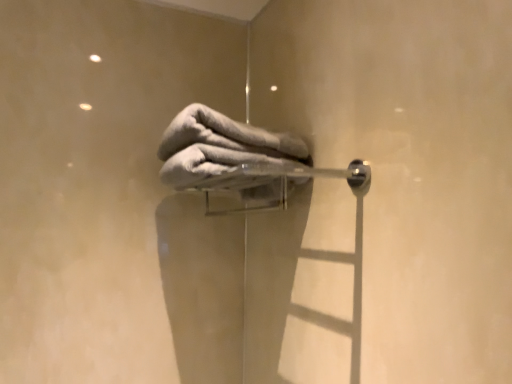
Image resolution: width=512 pixels, height=384 pixels. What do you see at coordinates (272, 184) in the screenshot?
I see `satin silver towel rack at center` at bounding box center [272, 184].

This screenshot has height=384, width=512. Find the location of `satin silver towel rack at center`. satin silver towel rack at center is located at coordinates tap(272, 184).

Describe the element at coordinates (220, 146) in the screenshot. I see `gray soft towel at center` at that location.

At what (x,y) coordinates should I click in order to perform the action: click on gray soft towel at center. Please return your answer as a coordinate pair (x, y). This screenshot has height=384, width=512. Looking at the image, I should click on (220, 146).

The height and width of the screenshot is (384, 512). Find the location of `satin silver towel rack at center`. satin silver towel rack at center is located at coordinates (272, 184).

In the scene shown: Which object is positioned more to the left, gray soft towel at center or satin silver towel rack at center?

gray soft towel at center.

Between gray soft towel at center and satin silver towel rack at center, which one is positioned in front?

satin silver towel rack at center is in front.

Which point is more forward, (207, 165) or (219, 193)?

The point (207, 165) is in front.

From the image's perspective, who appears lower, gray soft towel at center or satin silver towel rack at center?

satin silver towel rack at center appears lower in the image.

In the scene shown: From a real-world perspective, is gray soft towel at center positioned above or below satin silver towel rack at center?

gray soft towel at center is above satin silver towel rack at center.

Between gray soft towel at center and satin silver towel rack at center, which one has smaller width?

satin silver towel rack at center is thinner.

Looking at this image, which of these two, gray soft towel at center or satin silver towel rack at center, stands shorter?

Standing shorter between the two is satin silver towel rack at center.

Considering the relative sizes of gray soft towel at center and satin silver towel rack at center in the image provided, is gray soft towel at center bigger than satin silver towel rack at center?

No.

Would you say gray soft towel at center is inside or outside satin silver towel rack at center?

gray soft towel at center is not enclosed by satin silver towel rack at center.

Are gray soft towel at center and satin silver towel rack at center located far from each other?

They are positioned close to each other.

Could you tell me if gray soft towel at center is facing satin silver towel rack at center?

No, gray soft towel at center is not aimed at satin silver towel rack at center.

Can you tell me how much gray soft towel at center and satin silver towel rack at center differ in facing direction?

There is a 0.000226-degree angle between the facing directions of gray soft towel at center and satin silver towel rack at center.

This screenshot has width=512, height=384. What are the coordinates of `towel that is above the satin silver towel rack at center (from a real-world perspective)` in the screenshot? It's located at (220, 146).

Which is more to the left, satin silver towel rack at center or gray soft towel at center?

gray soft towel at center is more to the left.

In the image, is satin silver towel rack at center positioned in front of or behind gray soft towel at center?

Clearly, satin silver towel rack at center is in front of gray soft towel at center.

Does point (361, 184) appear closer or farther from the camera than point (244, 158)?

Point (361, 184).

From the image's perspective, is satin silver towel rack at center located beneath gray soft towel at center?

Yes.

From a real-world perspective, is satin silver towel rack at center positioned under gray soft towel at center based on gravity?

Yes.

Considering the relative sizes of satin silver towel rack at center and gray soft towel at center in the image provided, is satin silver towel rack at center wider than gray soft towel at center?

Incorrect, the width of satin silver towel rack at center does not surpass that of gray soft towel at center.

Between satin silver towel rack at center and gray soft towel at center, which one has more height?

gray soft towel at center.

Does satin silver towel rack at center have a larger size compared to gray soft towel at center?

Yes.

Is gray soft towel at center surrounded by satin silver towel rack at center?

No, satin silver towel rack at center does not contain gray soft towel at center.

Is satin silver towel rack at center far from gray soft towel at center?

No.

Is satin silver towel rack at center oriented towards gray soft towel at center?

No, satin silver towel rack at center is not aimed at gray soft towel at center.

Find the location of a particular element. towel behind the satin silver towel rack at center is located at coordinates (220, 146).

You are a GUI agent. You are given a task and a screenshot of the screen. Output one action in this format:
    pyautogui.click(x=<x>, y=<y>)
    Task: Click on the door handle below the gray soft towel at center (from the image's perspective)
    
    Given the screenshot: What is the action you would take?
    pyautogui.click(x=272, y=184)

Locate an element on the screen. towel above the satin silver towel rack at center (from the image's perspective) is located at coordinates [x=220, y=146].